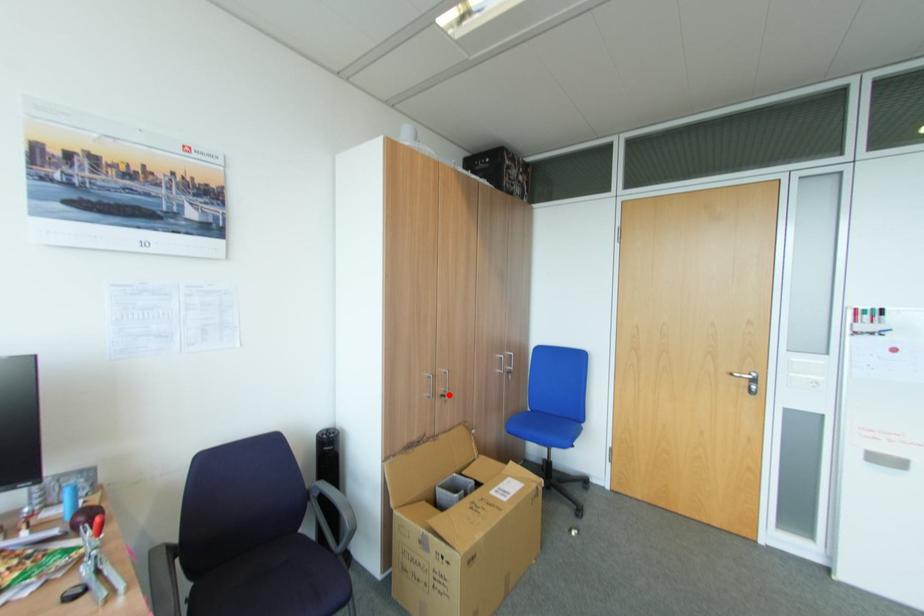
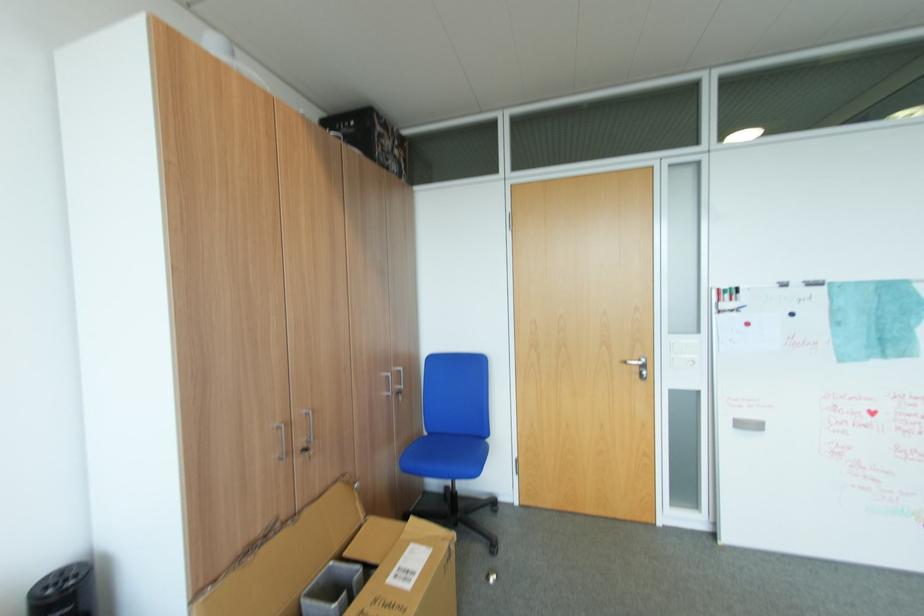
Question: I am providing you with two images of the same scene from different viewpoints. Image1 has a red point marked. In image2, the corresponding 3D location appears at what relative position? Reply with the corresponding letter.

Choices:
 (A) Closer
 (B) Farther

Answer: (A)